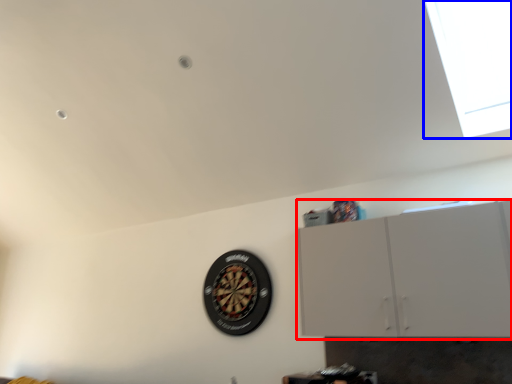
Question: Which object appears farthest to the camera in this image, cabinetry (highlighted by a red box) or window (highlighted by a blue box)?

Choices:
 (A) cabinetry
 (B) window

Answer: (A)